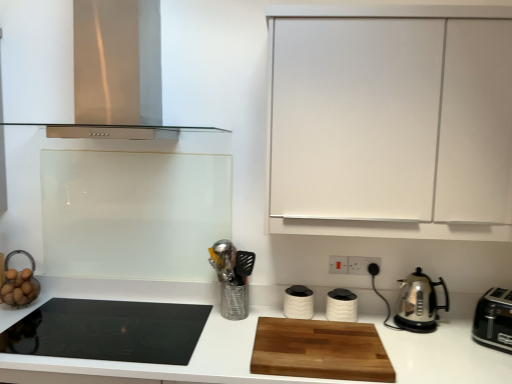
Image resolution: width=512 pixels, height=384 pixels. What are the coordinates of `polished stainless steel kettle at right, positioned as the second kitchen appliance in right-to-left order` in the screenshot? It's located at 419,303.

What do you see at coordinates (494, 320) in the screenshot? I see `black plastic toaster at right, the first kitchen appliance viewed from the right` at bounding box center [494, 320].

How much space does white plastic electric outlet at center-right, acting as the third electric outlet starting from the right, occupy horizontally?

white plastic electric outlet at center-right, acting as the third electric outlet starting from the right, is 0.65 inches wide.

The image size is (512, 384). What do you see at coordinates (93, 69) in the screenshot?
I see `stainless steel range hood at upper left` at bounding box center [93, 69].

The image size is (512, 384). I want to click on polished stainless steel kettle at right, positioned as the second kitchen appliance in right-to-left order, so click(419, 303).

From the image's perspective, which one is positioned lower, black glass cooktop at lower left or white matte canisters at center, the second kitchen appliance when ordered from left to right?

black glass cooktop at lower left.

Find the location of a particular element. gas stove on the left side of white matte canisters at center, the second kitchen appliance when ordered from left to right is located at coordinates (109, 331).

Does black glass cooktop at lower left have a lesser height compared to white matte canisters at center, the third kitchen appliance from the right?

Indeed, black glass cooktop at lower left has a lesser height compared to white matte canisters at center, the third kitchen appliance from the right.

From the image's perspective, is black plastic electric outlet at center-right, arranged as the 1th electric outlet when viewed from the right, above or below wooden cutting board at center?

From the image's perspective, black plastic electric outlet at center-right, arranged as the 1th electric outlet when viewed from the right, appears above wooden cutting board at center.

Is black plastic electric outlet at center-right, which is the 3th electric outlet from left to right, positioned in front of wooden cutting board at center?

No, it is behind wooden cutting board at center.

Measure the distance between black plastic electric outlet at center-right, which is the 3th electric outlet from left to right, and wooden cutting board at center.

black plastic electric outlet at center-right, which is the 3th electric outlet from left to right, is 27.78 inches from wooden cutting board at center.

Is black plastic electric outlet at center-right, arranged as the 1th electric outlet when viewed from the right, inside the boundaries of wooden cutting board at center, or outside?

The correct answer is: outside.

Considering the positions of objects black glass cooktop at lower left and black plastic toaster at right, the first kitchen appliance viewed from the right, in the image provided, who is in front, black glass cooktop at lower left or black plastic toaster at right, the first kitchen appliance viewed from the right,?

black glass cooktop at lower left is in front.

Between point (48, 354) and point (496, 317), which one is positioned in front?

The point (48, 354) is closer.

From a real-world perspective, which is physically below, black glass cooktop at lower left or black plastic toaster at right, the first kitchen appliance viewed from the right?

In real-world perspective, black glass cooktop at lower left is lower.

Is black glass cooktop at lower left placed right next to black plastic toaster at right, the first kitchen appliance viewed from the right?

No.

Is metallic silver utensil holder at center aimed at white plastic electric outlet at center-right, acting as the first electric outlet starting from the left?

No, metallic silver utensil holder at center does not turn towards white plastic electric outlet at center-right, acting as the first electric outlet starting from the left.

Which object is closer to the camera taking this photo, metallic silver utensil holder at center or white plastic electric outlet at center-right, acting as the first electric outlet starting from the left?

metallic silver utensil holder at center is in front.

From a real-world perspective, which is physically below, metallic silver utensil holder at center or white plastic electric outlet at center-right, acting as the first electric outlet starting from the left?

metallic silver utensil holder at center, from a real-world perspective.

Would you say stainless steel range hood at upper left is outside white plastic electric outlet at center-right, acting as the third electric outlet starting from the right?

Yes, stainless steel range hood at upper left is located beyond the bounds of white plastic electric outlet at center-right, acting as the third electric outlet starting from the right.

Is stainless steel range hood at upper left bigger or smaller than white plastic electric outlet at center-right, acting as the first electric outlet starting from the left?

In the image, stainless steel range hood at upper left appears to be larger than white plastic electric outlet at center-right, acting as the first electric outlet starting from the left.

From the image's perspective, is stainless steel range hood at upper left under white plastic electric outlet at center-right, acting as the third electric outlet starting from the right?

Incorrect, from the image's perspective, stainless steel range hood at upper left is higher than white plastic electric outlet at center-right, acting as the third electric outlet starting from the right.

Could you tell me if white plastic electric outlet at center-right, acting as the third electric outlet starting from the right, is facing black glass cooktop at lower left?

No, white plastic electric outlet at center-right, acting as the third electric outlet starting from the right, is not aimed at black glass cooktop at lower left.

Considering the relative positions of white plastic electric outlet at center-right, acting as the first electric outlet starting from the left, and black glass cooktop at lower left in the image provided, is white plastic electric outlet at center-right, acting as the first electric outlet starting from the left, to the left or to the right of black glass cooktop at lower left?

Based on their positions, white plastic electric outlet at center-right, acting as the first electric outlet starting from the left, is located to the right of black glass cooktop at lower left.

Which point is more distant from viewer, (332, 263) or (126, 360)?

The point (332, 263) is farther from the camera.

Would you say white plastic electric outlet at center-right, acting as the first electric outlet starting from the left, is to the left or to the right of black plastic toaster at right, the first kitchen appliance viewed from the right, in the picture?

white plastic electric outlet at center-right, acting as the first electric outlet starting from the left, is positioned on black plastic toaster at right, the first kitchen appliance viewed from the right,'s left side.

Starting from the white plastic electric outlet at center-right, acting as the third electric outlet starting from the right, which kitchen appliance is the 2nd one to the right? Please provide its 2D coordinates.

[(494, 320)]

Considering the positions of point (339, 257) and point (484, 297), is point (339, 257) closer or farther from the camera than point (484, 297)?

Point (339, 257) is positioned farther from the camera compared to point (484, 297).

Is white plastic electric outlet at center-right, acting as the first electric outlet starting from the left, in front of or behind black plastic toaster at right, the first kitchen appliance viewed from the right, in the image?

Visually, white plastic electric outlet at center-right, acting as the first electric outlet starting from the left, is located behind black plastic toaster at right, the first kitchen appliance viewed from the right.

At what (x,y) coordinates should I click in order to perform the action: click on gas stove located underneath the white matte canisters at center, the third kitchen appliance from the right (from a real-world perspective). Please return your answer as a coordinate pair (x, y). Looking at the image, I should click on (109, 331).

Locate an element on the screen. This screenshot has width=512, height=384. countertop in front of the black plastic electric outlet at center-right, which is the 3th electric outlet from left to right is located at coordinates point(163,302).

Which object lies further to the anchor point black glass cooktop at lower left, wooden cutting board at center or white matte cabinet at upper right?

The object further to black glass cooktop at lower left is white matte cabinet at upper right.

Based on their spatial positions, is black plastic toaster at right, the first kitchen appliance viewed from the right, or stainless steel range hood at upper left further from metallic silver utensil holder at center?

black plastic toaster at right, the first kitchen appliance viewed from the right.

From the image, which object appears to be nearer to black plastic electric outlet at center-right, which is the 3th electric outlet from left to right, white plastic electric outlet at lower center, which appears as the second electric outlet when viewed from the right, or white matte cabinet at upper right?

Among the two, white plastic electric outlet at lower center, which appears as the second electric outlet when viewed from the right, is located nearer to black plastic electric outlet at center-right, which is the 3th electric outlet from left to right.

From the image, which object appears to be farther from wooden cutting board at center, metallic silver utensil holder at center or white matte canister at center, the fourth kitchen appliance viewed from the right?

The object further to wooden cutting board at center is white matte canister at center, the fourth kitchen appliance viewed from the right.

Looking at the image, which one is located further to white matte canisters at center, the second kitchen appliance when ordered from left to right, polished stainless steel kettle at right, positioned as the second kitchen appliance in right-to-left order, or metallic silver utensil holder at center?

metallic silver utensil holder at center.

When comparing their distances from white plastic electric outlet at lower center, which appears as the second electric outlet when viewed from the right, does polished stainless steel kettle at right, positioned as the second kitchen appliance in right-to-left order, or white matte cabinet at upper right seem further?

The object further to white plastic electric outlet at lower center, which appears as the second electric outlet when viewed from the right, is white matte cabinet at upper right.

When comparing their distances from white matte cabinet at upper right, does black glass cooktop at lower left or black plastic electric outlet at center-right, arranged as the 1th electric outlet when viewed from the right, seem closer?

Based on the image, black plastic electric outlet at center-right, arranged as the 1th electric outlet when viewed from the right, appears to be nearer to white matte cabinet at upper right.

Which object lies nearer to the anchor point stainless steel range hood at upper left, black plastic toaster at right, positioned as the fourth kitchen appliance in left-to-right order, or white matte cabinet at upper right?

white matte cabinet at upper right.

What are the coordinates of `appliance between black glass cooktop at lower left and white matte cabinet at upper right from left to right` in the screenshot? It's located at pyautogui.click(x=232, y=278).

Where is `kitchen appliance between black glass cooktop at lower left and wooden cutting board at center`? kitchen appliance between black glass cooktop at lower left and wooden cutting board at center is located at coordinates (298, 302).

The height and width of the screenshot is (384, 512). In order to click on kitchen appliance between metallic silver utensil holder at center and white matte canisters at center, the second kitchen appliance when ordered from left to right, in the horizontal direction in this screenshot , I will do `click(298, 302)`.

The image size is (512, 384). In order to click on cutting board situated between wooden cutting board at center and white plastic electric outlet at center-right, acting as the third electric outlet starting from the right, from left to right in this screenshot , I will do `click(320, 350)`.